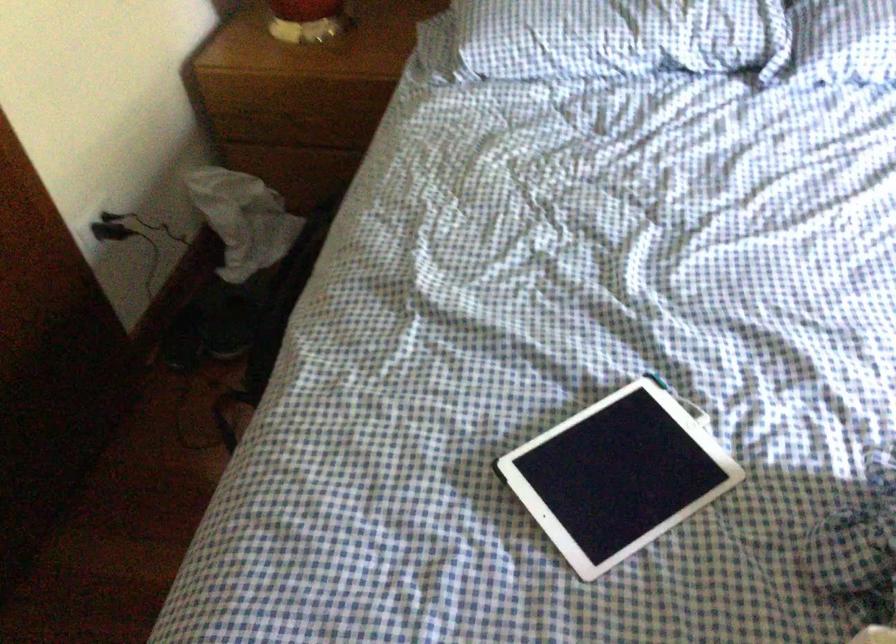
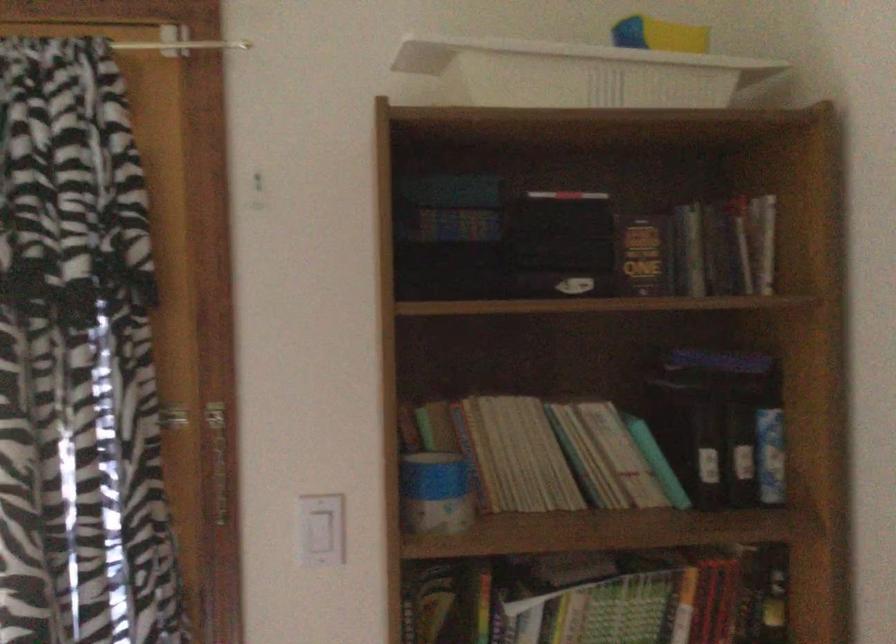
Question: How did the camera likely rotate?

Choices:
 (A) Left
 (B) Right
 (C) Up
 (D) Down

Answer: (B)